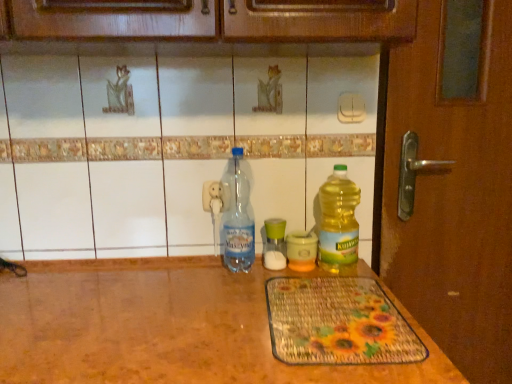
The width and height of the screenshot is (512, 384). Find the location of `transparent plastic bottle at center, which appears as the 1th bottle when viewed from the left`. transparent plastic bottle at center, which appears as the 1th bottle when viewed from the left is located at coordinates (238, 218).

Image resolution: width=512 pixels, height=384 pixels. What do you see at coordinates (301, 251) in the screenshot?
I see `yellow translucent bottle at center, the second bottle positioned from the right` at bounding box center [301, 251].

The width and height of the screenshot is (512, 384). In order to click on green glass jar at center, arranged as the 2th bottle when viewed from the left in this screenshot , I will do `click(274, 244)`.

From the picture: From a real-world perspective, relative to transparent plastic bottle at center, which appears as the fourth bottle when viewed from the right, is green glass jar at center, which is the 3th bottle from right to left, vertically above or below?

green glass jar at center, which is the 3th bottle from right to left, is below transparent plastic bottle at center, which appears as the fourth bottle when viewed from the right.

Is green glass jar at center, which is the 3th bottle from right to left, aimed at transparent plastic bottle at center, which appears as the 1th bottle when viewed from the left?

No, green glass jar at center, which is the 3th bottle from right to left, is not facing towards transparent plastic bottle at center, which appears as the 1th bottle when viewed from the left.

Is point (272, 266) behind point (228, 264)?

Yes, point (272, 266) is behind point (228, 264).

Does green glass jar at center, which is the 3th bottle from right to left, lie behind transparent plastic bottle at center, which appears as the fourth bottle when viewed from the right?

Yes, the depth of green glass jar at center, which is the 3th bottle from right to left, is greater than that of transparent plastic bottle at center, which appears as the fourth bottle when viewed from the right.

Does translucent plastic bottle at right, marked as the first bottle in a right-to-left arrangement, have a lesser height compared to green glass jar at center, arranged as the 2th bottle when viewed from the left?

In fact, translucent plastic bottle at right, marked as the first bottle in a right-to-left arrangement, may be taller than green glass jar at center, arranged as the 2th bottle when viewed from the left.

Is translucent plastic bottle at right, marked as the first bottle in a right-to-left arrangement, positioned beyond the bounds of green glass jar at center, arranged as the 2th bottle when viewed from the left?

Yes, translucent plastic bottle at right, marked as the first bottle in a right-to-left arrangement, is not within green glass jar at center, arranged as the 2th bottle when viewed from the left.

Considering their positions, is translucent plastic bottle at right, which appears as the fourth bottle when viewed from the left, located in front of or behind green glass jar at center, which is the 3th bottle from right to left?

Visually, translucent plastic bottle at right, which appears as the fourth bottle when viewed from the left, is located in front of green glass jar at center, which is the 3th bottle from right to left.

Is translucent plastic bottle at right, marked as the first bottle in a right-to-left arrangement, smaller than green glass jar at center, which is the 3th bottle from right to left?

No.

Consider the image. Which object is closer to the camera taking this photo, transparent plastic bottle at center, which appears as the fourth bottle when viewed from the right, or green glass jar at center, arranged as the 2th bottle when viewed from the left?

transparent plastic bottle at center, which appears as the fourth bottle when viewed from the right, is closer to the camera.

Is green glass jar at center, arranged as the 2th bottle when viewed from the left, located within transparent plastic bottle at center, which appears as the 1th bottle when viewed from the left?

No, green glass jar at center, arranged as the 2th bottle when viewed from the left, is not surrounded by transparent plastic bottle at center, which appears as the 1th bottle when viewed from the left.

Does transparent plastic bottle at center, which appears as the fourth bottle when viewed from the right, appear on the left side of green glass jar at center, which is the 3th bottle from right to left?

Yes.

How many degrees apart are the facing directions of yellow translucent bottle at center, which ranks as the 3th bottle in left-to-right order, and translucent plastic bottle at right, marked as the first bottle in a right-to-left arrangement?

The angular difference between yellow translucent bottle at center, which ranks as the 3th bottle in left-to-right order, and translucent plastic bottle at right, marked as the first bottle in a right-to-left arrangement, is 0.000767 degrees.

Relative to translucent plastic bottle at right, which appears as the fourth bottle when viewed from the left, is yellow translucent bottle at center, which ranks as the 3th bottle in left-to-right order, in front or behind?

In the image, yellow translucent bottle at center, which ranks as the 3th bottle in left-to-right order, appears behind translucent plastic bottle at right, which appears as the fourth bottle when viewed from the left.

Which of these two, yellow translucent bottle at center, the second bottle positioned from the right, or translucent plastic bottle at right, marked as the first bottle in a right-to-left arrangement, is thinner?

translucent plastic bottle at right, marked as the first bottle in a right-to-left arrangement, is thinner.

This screenshot has width=512, height=384. What are the coordinates of `the 2nd bottle positioned below the translucent plastic bottle at right, marked as the first bottle in a right-to-left arrangement (from a real-world perspective)` in the screenshot? It's located at (301, 251).

Does point (269, 264) come behind point (298, 238)?

Yes, point (269, 264) is farther from viewer.

Considering the sizes of green glass jar at center, arranged as the 2th bottle when viewed from the left, and yellow translucent bottle at center, the second bottle positioned from the right, in the image, is green glass jar at center, arranged as the 2th bottle when viewed from the left, wider or thinner than yellow translucent bottle at center, the second bottle positioned from the right,?

In the image, green glass jar at center, arranged as the 2th bottle when viewed from the left, appears to be more narrow than yellow translucent bottle at center, the second bottle positioned from the right.

Which object is further away from the camera, green glass jar at center, which is the 3th bottle from right to left, or yellow translucent bottle at center, the second bottle positioned from the right?

green glass jar at center, which is the 3th bottle from right to left, is more distant.

From a real-world perspective, is green glass jar at center, which is the 3th bottle from right to left, positioned over yellow translucent bottle at center, the second bottle positioned from the right, based on gravity?

Correct, in the physical world, green glass jar at center, which is the 3th bottle from right to left, is higher than yellow translucent bottle at center, the second bottle positioned from the right.

Is transparent plastic bottle at center, which appears as the 1th bottle when viewed from the left, in contact with translucent plastic bottle at right, marked as the first bottle in a right-to-left arrangement?

transparent plastic bottle at center, which appears as the 1th bottle when viewed from the left, and translucent plastic bottle at right, marked as the first bottle in a right-to-left arrangement, are clearly separated.

Does transparent plastic bottle at center, which appears as the 1th bottle when viewed from the left, come behind translucent plastic bottle at right, which appears as the fourth bottle when viewed from the left?

No, transparent plastic bottle at center, which appears as the 1th bottle when viewed from the left, is closer to the viewer.

You are a GUI agent. You are given a task and a screenshot of the screen. Output one action in this format:
    pyautogui.click(x=<x>, y=<y>)
    Task: Click on the 3rd bottle to the right when counting from the transparent plastic bottle at center, which appears as the 1th bottle when viewed from the left
    This screenshot has width=512, height=384.
    Given the screenshot: What is the action you would take?
    pyautogui.click(x=338, y=221)

In the image, is transparent plastic bottle at center, which appears as the fourth bottle when viewed from the right, on the left side or the right side of translucent plastic bottle at right, marked as the first bottle in a right-to-left arrangement?

transparent plastic bottle at center, which appears as the fourth bottle when viewed from the right, is to the left of translucent plastic bottle at right, marked as the first bottle in a right-to-left arrangement.

Is yellow translucent bottle at center, which ranks as the 3th bottle in left-to-right order, aimed at green glass jar at center, arranged as the 2th bottle when viewed from the left?

No, yellow translucent bottle at center, which ranks as the 3th bottle in left-to-right order, is not facing towards green glass jar at center, arranged as the 2th bottle when viewed from the left.

How many degrees apart are the facing directions of yellow translucent bottle at center, the second bottle positioned from the right, and green glass jar at center, which is the 3th bottle from right to left?

There is a 3.86e-05-degree angle between the facing directions of yellow translucent bottle at center, the second bottle positioned from the right, and green glass jar at center, which is the 3th bottle from right to left.

How much distance is there between yellow translucent bottle at center, the second bottle positioned from the right, and green glass jar at center, arranged as the 2th bottle when viewed from the left?

yellow translucent bottle at center, the second bottle positioned from the right, and green glass jar at center, arranged as the 2th bottle when viewed from the left, are 4.88 centimeters apart.

From a real-world perspective, does yellow translucent bottle at center, which ranks as the 3th bottle in left-to-right order, sit lower than green glass jar at center, arranged as the 2th bottle when viewed from the left?

Yes, from a real-world perspective, yellow translucent bottle at center, which ranks as the 3th bottle in left-to-right order, is beneath green glass jar at center, arranged as the 2th bottle when viewed from the left.

The width and height of the screenshot is (512, 384). What are the coordinates of `the 3rd bottle in front of the green glass jar at center, which is the 3th bottle from right to left` in the screenshot? It's located at (238, 218).

Where is `the 2nd bottle to the right of the green glass jar at center, which is the 3th bottle from right to left, counting from the anchor's position`? This screenshot has width=512, height=384. the 2nd bottle to the right of the green glass jar at center, which is the 3th bottle from right to left, counting from the anchor's position is located at coordinates pos(338,221).

From the image, which object appears to be farther from translucent plastic bottle at right, marked as the first bottle in a right-to-left arrangement, yellow translucent bottle at center, which ranks as the 3th bottle in left-to-right order, or transparent plastic bottle at center, which appears as the 1th bottle when viewed from the left?

Based on the image, transparent plastic bottle at center, which appears as the 1th bottle when viewed from the left, appears to be further to translucent plastic bottle at right, marked as the first bottle in a right-to-left arrangement.

When comparing their distances from transparent plastic bottle at center, which appears as the fourth bottle when viewed from the right, does translucent plastic bottle at right, which appears as the fourth bottle when viewed from the left, or green glass jar at center, arranged as the 2th bottle when viewed from the left, seem closer?

Based on the image, green glass jar at center, arranged as the 2th bottle when viewed from the left, appears to be nearer to transparent plastic bottle at center, which appears as the fourth bottle when viewed from the right.

From the image, which object appears to be nearer to yellow translucent bottle at center, the second bottle positioned from the right, transparent plastic bottle at center, which appears as the 1th bottle when viewed from the left, or green glass jar at center, arranged as the 2th bottle when viewed from the left?

The object closer to yellow translucent bottle at center, the second bottle positioned from the right, is green glass jar at center, arranged as the 2th bottle when viewed from the left.

When comparing their distances from green glass jar at center, arranged as the 2th bottle when viewed from the left, does transparent plastic bottle at center, which appears as the fourth bottle when viewed from the right, or translucent plastic bottle at right, which appears as the fourth bottle when viewed from the left, seem closer?

The object closer to green glass jar at center, arranged as the 2th bottle when viewed from the left, is transparent plastic bottle at center, which appears as the fourth bottle when viewed from the right.

From the image, which object appears to be farther from yellow translucent bottle at center, which ranks as the 3th bottle in left-to-right order, transparent plastic bottle at center, which appears as the 1th bottle when viewed from the left, or translucent plastic bottle at right, marked as the first bottle in a right-to-left arrangement?

transparent plastic bottle at center, which appears as the 1th bottle when viewed from the left, is positioned further to the anchor yellow translucent bottle at center, which ranks as the 3th bottle in left-to-right order.

When comparing their distances from translucent plastic bottle at right, which appears as the fourth bottle when viewed from the left, does green glass jar at center, arranged as the 2th bottle when viewed from the left, or transparent plastic bottle at center, which appears as the 1th bottle when viewed from the left, seem closer?

The object closer to translucent plastic bottle at right, which appears as the fourth bottle when viewed from the left, is green glass jar at center, arranged as the 2th bottle when viewed from the left.

When comparing their distances from yellow translucent bottle at center, the second bottle positioned from the right, does translucent plastic bottle at right, marked as the first bottle in a right-to-left arrangement, or green glass jar at center, arranged as the 2th bottle when viewed from the left, seem closer?

green glass jar at center, arranged as the 2th bottle when viewed from the left.

Estimate the real-world distances between objects in this image. Which object is further from yellow translucent bottle at center, which ranks as the 3th bottle in left-to-right order, translucent plastic bottle at right, which appears as the fourth bottle when viewed from the left, or transparent plastic bottle at center, which appears as the fourth bottle when viewed from the right?

transparent plastic bottle at center, which appears as the fourth bottle when viewed from the right.

You are a GUI agent. You are given a task and a screenshot of the screen. Output one action in this format:
    pyautogui.click(x=<x>, y=<y>)
    Task: Click on the bottle between green glass jar at center, arranged as the 2th bottle when viewed from the left, and translucent plastic bottle at right, which appears as the fourth bottle when viewed from the left
    
    Given the screenshot: What is the action you would take?
    pyautogui.click(x=301, y=251)

Identify the location of bottle between transparent plastic bottle at center, which appears as the fourth bottle when viewed from the right, and yellow translucent bottle at center, the second bottle positioned from the right, in the horizontal direction. (274, 244).